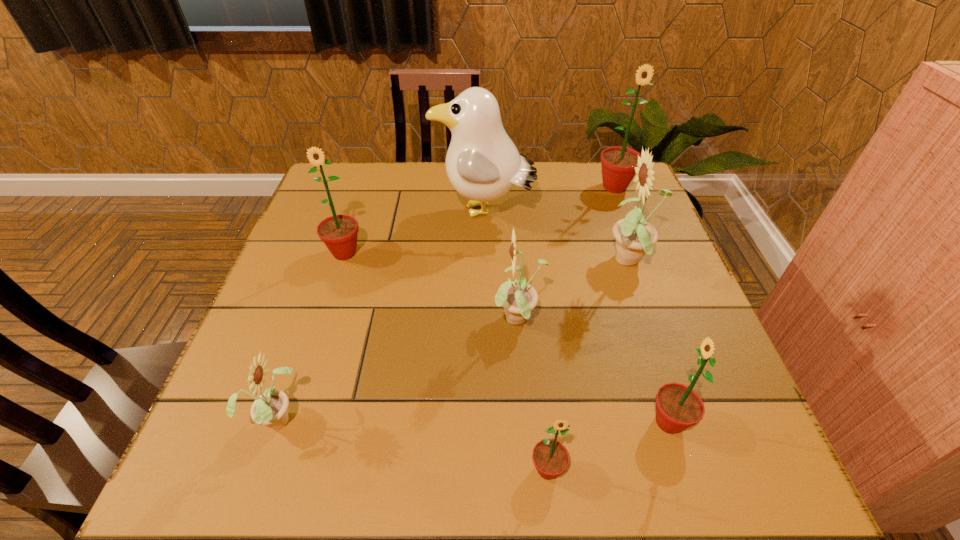
Locate an element on the screen. vacant area situated 0.080m on the front-facing side of the farthest yellow sunflower is located at coordinates (569, 262).

Identify the location of free space located 0.170m on the face of the leftmost green sunflower. (323, 320).

You are a GUI agent. You are given a task and a screenshot of the screen. Output one action in this format:
    pyautogui.click(x=<x>, y=<y>)
    Task: Click on the free location located on the front-facing side of the second smallest yellow sunflower
    The image size is (960, 540).
    Given the screenshot: What is the action you would take?
    pyautogui.click(x=438, y=321)

Find the location of a particular element. The image size is (960, 540). vacant space positioned on the front-facing side of the second smallest yellow sunflower is located at coordinates (442, 321).

Locate an element on the screen. The image size is (960, 540). free space located 0.080m on the front-facing side of the second smallest yellow sunflower is located at coordinates (456, 321).

The width and height of the screenshot is (960, 540). I want to click on free space located 0.280m on the face of the second nearest green sunflower, so (x=491, y=422).

Locate an element on the screen. This screenshot has height=540, width=960. blank space located on the face of the second nearest green sunflower is located at coordinates (473, 422).

Identify the location of blank space located on the face of the second nearest green sunflower. (558, 422).

You are a GUI agent. You are given a task and a screenshot of the screen. Output one action in this format:
    pyautogui.click(x=<x>, y=<y>)
    Task: Click on the free space located on the front-facing side of the leftmost yellow sunflower
    The width and height of the screenshot is (960, 540).
    Given the screenshot: What is the action you would take?
    pyautogui.click(x=457, y=417)

At what (x,y) coordinates should I click in order to perform the action: click on sunflower present at the far edge. Please return your answer as a coordinate pair (x, y). The height and width of the screenshot is (540, 960). Looking at the image, I should click on (618, 164).